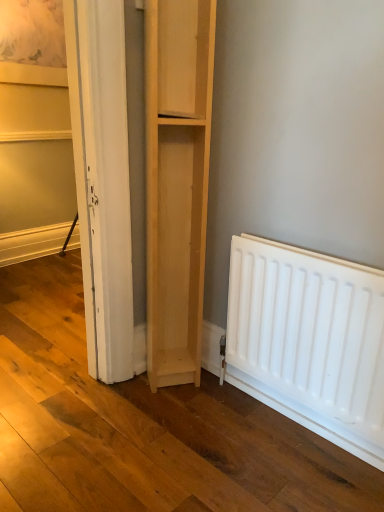
You are a GUI agent. You are given a task and a screenshot of the screen. Output one action in this format:
    pyautogui.click(x=<x>, y=<y>)
    Task: Click on the free space in front of natural wood cupboard at center
    The image size is (384, 512).
    Given the screenshot: What is the action you would take?
    pyautogui.click(x=167, y=407)